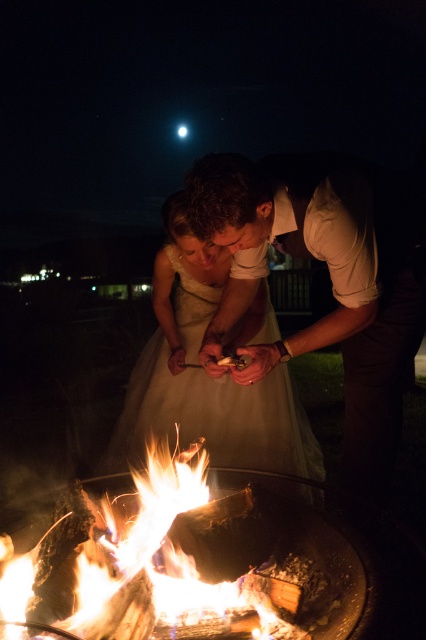
Does white satin dress at center appear under flaming wood at center?

Incorrect, white satin dress at center is not positioned below flaming wood at center.

Between point (199, 406) and point (181, 506), which one is positioned in front?

Point (181, 506) is more forward.

Identify the location of white satin dress at center. (215, 417).

Does smooth beige shirt at center have a greater height compared to white satin dress at center?

Yes.

From the picture: Can you confirm if smooth beige shirt at center is positioned to the right of white satin dress at center?

Yes, smooth beige shirt at center is to the right of white satin dress at center.

Between point (405, 355) and point (141, 387), which one is positioned behind?

The point (141, 387) is more distant.

At what (x,y) coordinates should I click in order to perform the action: click on smooth beige shirt at center. Please return your answer as a coordinate pair (x, y). Looking at the image, I should click on [330, 275].

Does smooth beige shirt at center have a larger size compared to flaming wood at center?

Correct, smooth beige shirt at center is larger in size than flaming wood at center.

Does smooth beige shirt at center have a greater height compared to flaming wood at center?

Indeed, smooth beige shirt at center has a greater height compared to flaming wood at center.

Who is more forward, (x=388, y=330) or (x=152, y=595)?

Positioned in front is point (x=152, y=595).

This screenshot has height=640, width=426. Identify the location of smooth beige shirt at center. (330, 275).